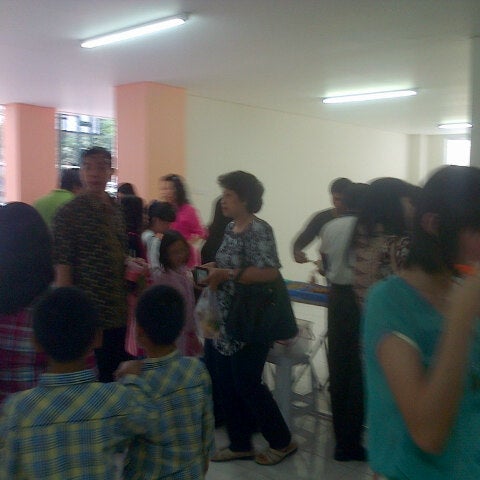
The image size is (480, 480). What are the coordinates of `wall` in the screenshot? It's located at (295, 168).